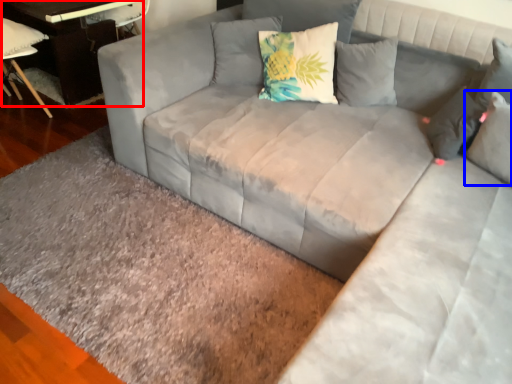
Question: Among these objects, which one is farthest to the camera, table (highlighted by a red box) or pillow (highlighted by a blue box)?

Choices:
 (A) table
 (B) pillow

Answer: (A)